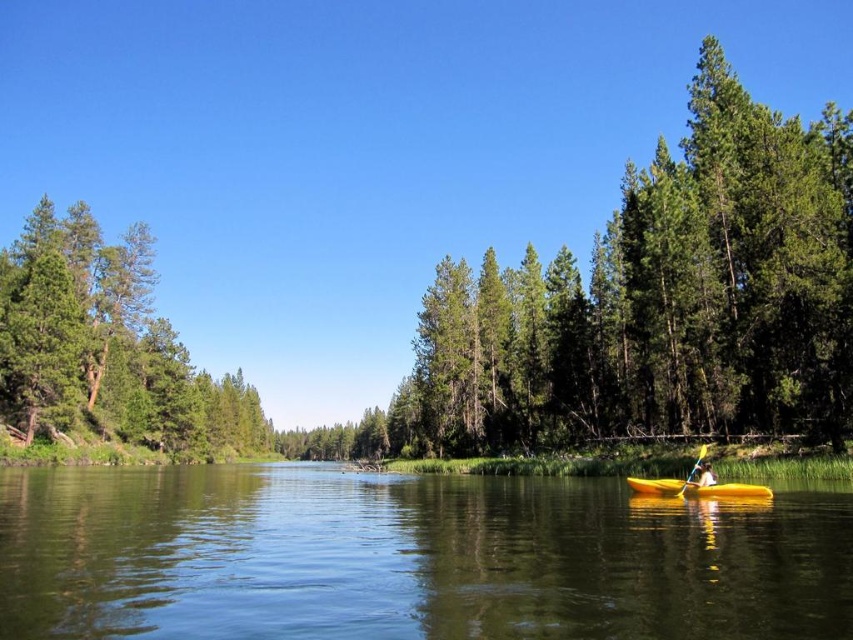
Does point (699, 180) come in front of point (705, 472)?

No, it is behind (705, 472).

Between green textured tree at center and yellow plastic kayak at center-right, which one has more height?

With more height is green textured tree at center.

Image resolution: width=853 pixels, height=640 pixels. I want to click on green textured tree at center, so click(x=648, y=307).

Does green textured tree at center appear on the left side of yellow matte kayak at lower center?

Indeed, green textured tree at center is positioned on the left side of yellow matte kayak at lower center.

Is point (592, 282) in front of point (735, 490)?

No.

Find the location of `green textured tree at center`. green textured tree at center is located at coordinates (648, 307).

Does green matte tree at left have a larger size compared to yellow plastic kayak at center-right?

Yes, green matte tree at left is bigger than yellow plastic kayak at center-right.

In the scene shown: Which of these two, green matte tree at left or yellow plastic kayak at center-right, stands shorter?

Standing shorter between the two is yellow plastic kayak at center-right.

Between point (122, 275) and point (708, 484), which one is positioned behind?

The point (122, 275) is more distant.

Identify the location of green matte tree at left. The height and width of the screenshot is (640, 853). (107, 348).